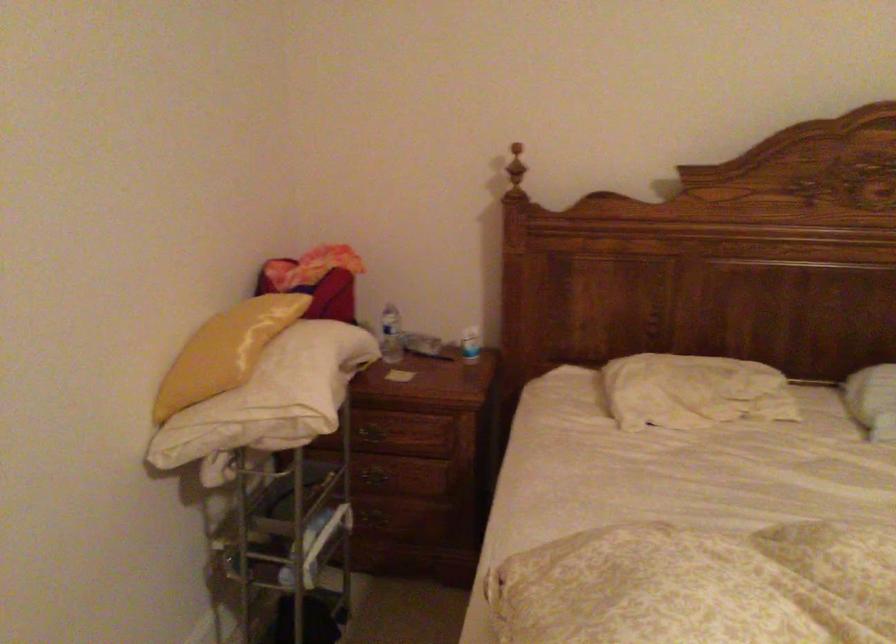
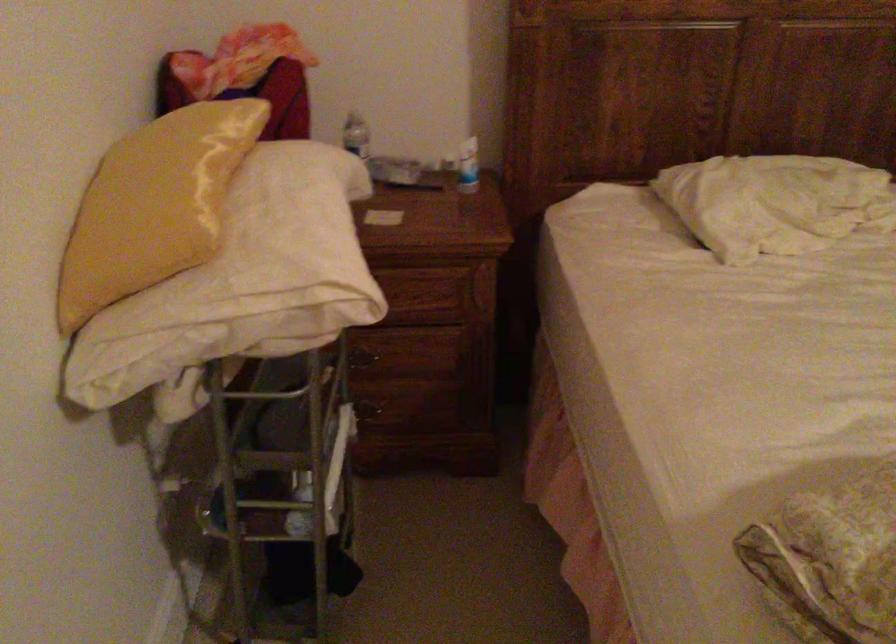
Locate, in the second image, the point that corresponds to point (676, 389) in the first image.

(774, 202)